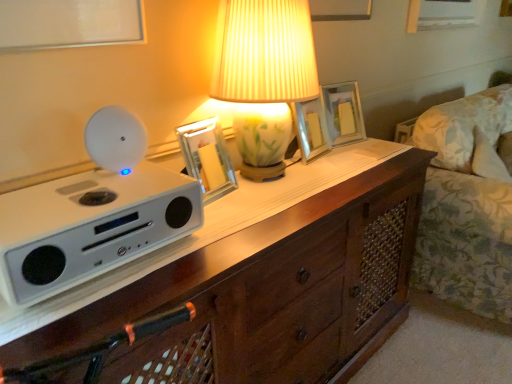
This screenshot has height=384, width=512. I want to click on vacant area that lies to the right of matte glass picture frame at center, the 1th picture frame from the right, so click(x=382, y=145).